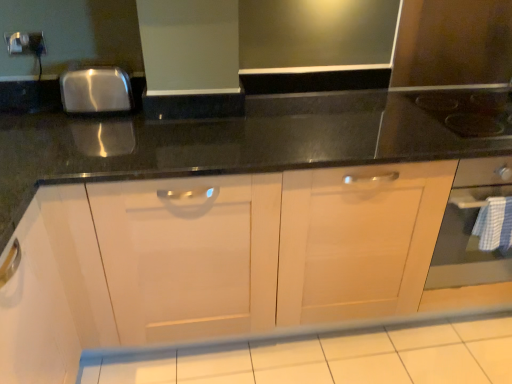
Question: From the image's perspective, is black glass gas stove at upper right above or below white glossy tile at lower center?

Choices:
 (A) below
 (B) above

Answer: (B)

Question: From a real-world perspective, is black glass gas stove at upper right positioned above or below white glossy tile at lower center?

Choices:
 (A) below
 (B) above

Answer: (B)

Question: Estimate the real-world distances between objects in this image. Which object is farther from the white glossy tile at lower center?

Choices:
 (A) metallic silver electric outlet at upper left
 (B) black glass gas stove at upper right

Answer: (A)

Question: Estimate the real-world distances between objects in this image. Which object is closer to the black glass gas stove at upper right?

Choices:
 (A) metallic silver electric outlet at upper left
 (B) white glossy tile at lower center

Answer: (B)